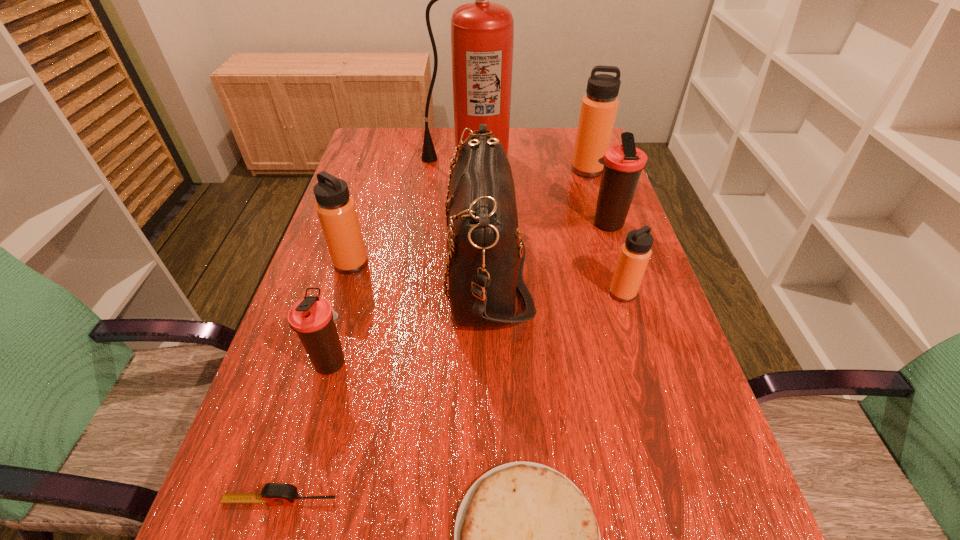
Identify the location of free space at the left edge of the desktop. (347, 181).

You are a GUI agent. You are given a task and a screenshot of the screen. Output one action in this format:
    pyautogui.click(x=<x>, y=<y>)
    Task: Click on the vacant area at the right edge
    The width and height of the screenshot is (960, 540).
    Given the screenshot: What is the action you would take?
    pyautogui.click(x=572, y=178)

Where is `vacant area that lies between the tallest object and the second nearest orange thermos bottle`? This screenshot has height=540, width=960. vacant area that lies between the tallest object and the second nearest orange thermos bottle is located at coordinates (410, 211).

Where is `free area in between the second nearest thermos bottle and the fire extinguisher`? The image size is (960, 540). free area in between the second nearest thermos bottle and the fire extinguisher is located at coordinates tap(545, 226).

The image size is (960, 540). I want to click on free space between the nearest thermos bottle and the handbag, so click(410, 315).

Image resolution: width=960 pixels, height=540 pixels. I want to click on vacant space in between the handbag and the second farthest orange thermos bottle, so click(419, 266).

Locate an element on the screen. unoccupied area between the nearest orange thermos bottle and the fourth nearest thermos bottle is located at coordinates (614, 259).

Where is `object that stands as the third closest to the smallest orange thermos bottle`? object that stands as the third closest to the smallest orange thermos bottle is located at coordinates (526, 539).

Find the location of a particular element. The image size is (960, 540). object that is the closest to the fourth nearest thermos bottle is located at coordinates (486, 253).

Locate an element on the screen. This screenshot has width=960, height=540. the closest thermos bottle relative to the shortest object is located at coordinates (312, 318).